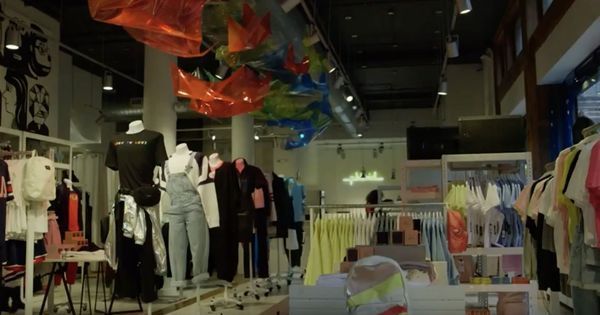
I want to click on black ceiling, so click(x=420, y=33).